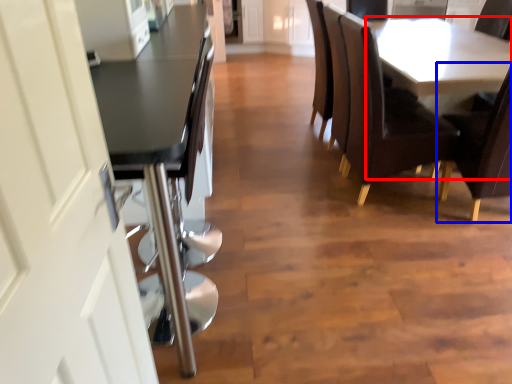
Question: Which of the following is the closest to the observer, table (highlighted by a red box) or chair (highlighted by a blue box)?

Choices:
 (A) table
 (B) chair

Answer: (B)